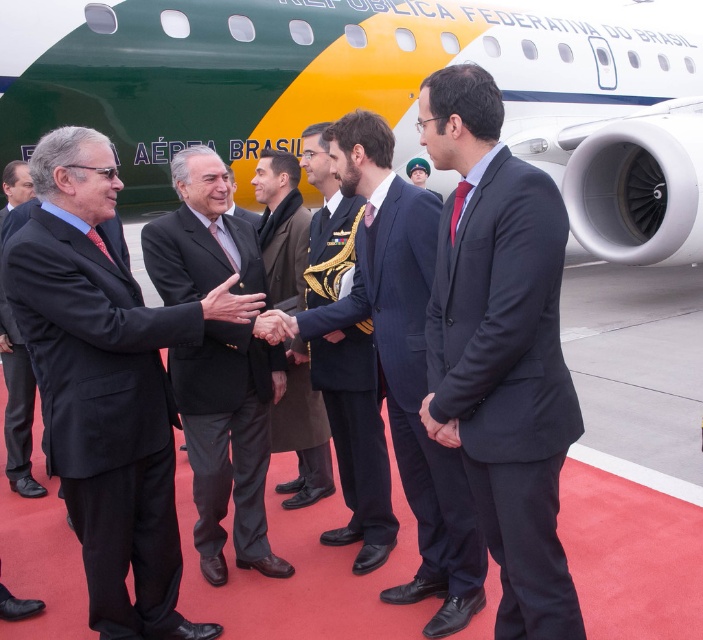
Is dark gray suit at center to the right of brown wool coat at center from the viewer's perspective?

Correct, you'll find dark gray suit at center to the right of brown wool coat at center.

Between dark gray suit at center and brown wool coat at center, which one appears on the right side from the viewer's perspective?

dark gray suit at center is more to the right.

Which is behind, point (536, 488) or point (269, 257)?

Point (269, 257)

The image size is (703, 640). In order to click on dark gray suit at center in this screenshot , I will do `click(508, 381)`.

Is black matte suit at center wider than dark brown suit at center?

Yes.

Is point (90, 328) farther from camera compared to point (250, 221)?

No, it is in front of (250, 221).

Who is more forward, [160,554] or [231,214]?

Point [160,554] is more forward.

Locate an element on the screen. This screenshot has width=703, height=640. black matte suit at center is located at coordinates (103, 413).

Does green matte airplane at upper center have a lesser width compared to dark blue wool suit at center?

Incorrect, green matte airplane at upper center's width is not less than dark blue wool suit at center's.

Which is more to the left, green matte airplane at upper center or dark blue wool suit at center?

Positioned to the left is dark blue wool suit at center.

The height and width of the screenshot is (640, 703). What do you see at coordinates (375, 93) in the screenshot?
I see `green matte airplane at upper center` at bounding box center [375, 93].

Locate an element on the screen. This screenshot has height=640, width=703. green matte airplane at upper center is located at coordinates (375, 93).